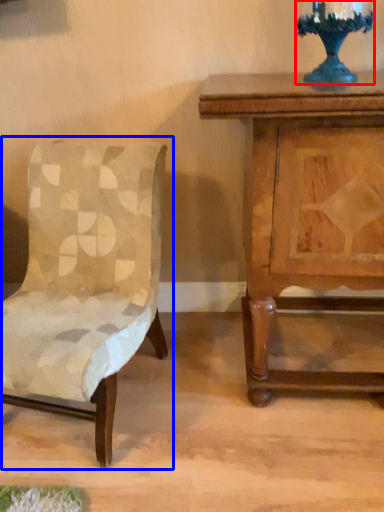
Question: Which of the following is the closest to the observer, candle holder (highlighted by a red box) or chair (highlighted by a blue box)?

Choices:
 (A) candle holder
 (B) chair

Answer: (B)